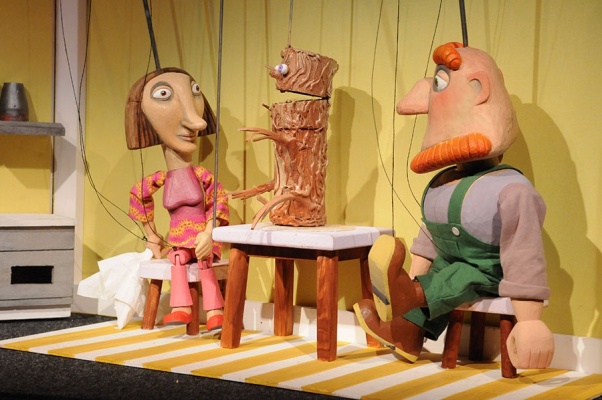
At what (x,y) coordinates should I click in order to perform the action: click on stool leg. Please return your answer as a coordinate pair (x, y). The width and height of the screenshot is (602, 400). Looking at the image, I should click on (448, 348), (504, 368), (150, 312), (191, 327).